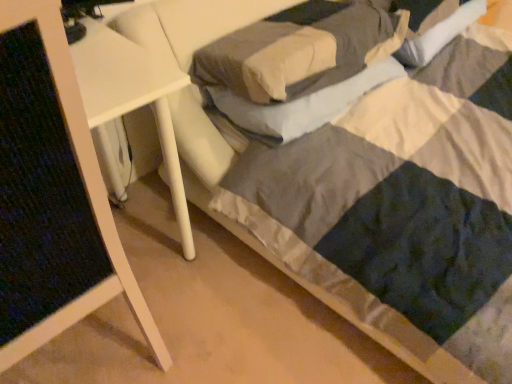
Question: Does soft gray pillow at center, arranged as the 1th pillow when viewed from the top, contain white glossy side table at upper left?

Choices:
 (A) yes
 (B) no

Answer: (B)

Question: From a real-world perspective, is soft gray pillow at center, acting as the 2th pillow starting from the bottom, below white glossy side table at upper left?

Choices:
 (A) no
 (B) yes

Answer: (A)

Question: Considering the relative sizes of soft gray pillow at center, acting as the 2th pillow starting from the bottom, and white glossy side table at upper left in the image provided, is soft gray pillow at center, acting as the 2th pillow starting from the bottom, taller than white glossy side table at upper left?

Choices:
 (A) no
 (B) yes

Answer: (A)

Question: Is soft gray pillow at center, acting as the 2th pillow starting from the bottom, closer to camera compared to white glossy side table at upper left?

Choices:
 (A) no
 (B) yes

Answer: (A)

Question: From a real-world perspective, is soft gray pillow at center, acting as the 2th pillow starting from the bottom, on top of white glossy side table at upper left?

Choices:
 (A) no
 (B) yes

Answer: (B)

Question: Considering the positions of white glossy side table at upper left and soft gray pillow at center, acting as the 2th pillow starting from the bottom, in the image, is white glossy side table at upper left taller or shorter than soft gray pillow at center, acting as the 2th pillow starting from the bottom,?

Choices:
 (A) short
 (B) tall

Answer: (B)

Question: Is white glossy side table at upper left bigger or smaller than soft gray pillow at center, arranged as the 1th pillow when viewed from the top?

Choices:
 (A) big
 (B) small

Answer: (A)

Question: Considering the positions of white glossy side table at upper left and soft gray pillow at center, acting as the 2th pillow starting from the bottom, in the image, is white glossy side table at upper left wider or thinner than soft gray pillow at center, acting as the 2th pillow starting from the bottom,?

Choices:
 (A) wide
 (B) thin

Answer: (A)

Question: From the image's perspective, relative to soft gray pillow at center, arranged as the 1th pillow when viewed from the top, is white glossy side table at upper left above or below?

Choices:
 (A) above
 (B) below

Answer: (B)

Question: Which is correct: soft white pillow at center, the 1th pillow positioned from the bottom, is inside soft gray pillow at center, acting as the 2th pillow starting from the bottom, or outside of it?

Choices:
 (A) inside
 (B) outside

Answer: (B)

Question: Considering the positions of soft white pillow at center, the 1th pillow positioned from the bottom, and soft gray pillow at center, arranged as the 1th pillow when viewed from the top, in the image, is soft white pillow at center, the 1th pillow positioned from the bottom, taller or shorter than soft gray pillow at center, arranged as the 1th pillow when viewed from the top,?

Choices:
 (A) tall
 (B) short

Answer: (B)

Question: From the image's perspective, relative to soft gray pillow at center, acting as the 2th pillow starting from the bottom, is soft white pillow at center, the 1th pillow positioned from the bottom, above or below?

Choices:
 (A) above
 (B) below

Answer: (B)

Question: Relative to soft gray pillow at center, acting as the 2th pillow starting from the bottom, is soft white pillow at center, the 2th pillow in the top-to-bottom sequence, in front or behind?

Choices:
 (A) behind
 (B) front

Answer: (A)

Question: From their relative heights in the image, would you say soft gray pillow at center, arranged as the 1th pillow when viewed from the top, is taller or shorter than white glossy side table at upper left?

Choices:
 (A) short
 (B) tall

Answer: (A)

Question: Considering the positions of soft gray pillow at center, acting as the 2th pillow starting from the bottom, and white glossy side table at upper left in the image, is soft gray pillow at center, acting as the 2th pillow starting from the bottom, bigger or smaller than white glossy side table at upper left?

Choices:
 (A) big
 (B) small

Answer: (B)